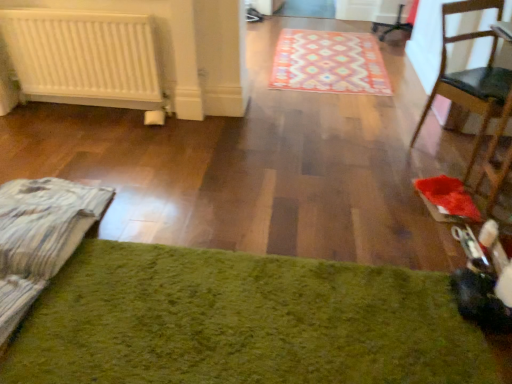
Find the location of `vacant location behind green shaggy rug at lower center, positioned as the second mat in top-to-bottom order`. vacant location behind green shaggy rug at lower center, positioned as the second mat in top-to-bottom order is located at coordinates (322, 157).